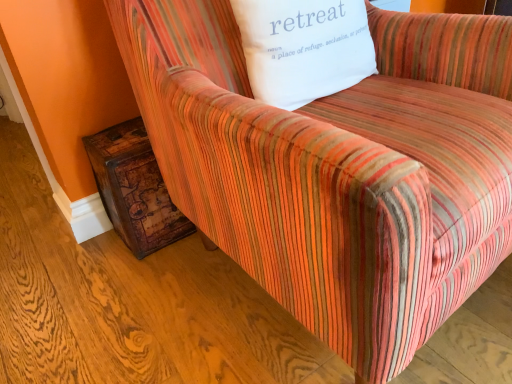
Question: Visually, is white cotton pillow at upper center positioned to the left or to the right of rustic wood side table at lower left?

Choices:
 (A) left
 (B) right

Answer: (B)

Question: Is point (365, 46) positioned closer to the camera than point (138, 208)?

Choices:
 (A) farther
 (B) closer

Answer: (B)

Question: Considering the positions of white cotton pillow at upper center and rustic wood side table at lower left in the image, is white cotton pillow at upper center bigger or smaller than rustic wood side table at lower left?

Choices:
 (A) big
 (B) small

Answer: (A)

Question: Considering the positions of rustic wood side table at lower left and white cotton pillow at upper center in the image, is rustic wood side table at lower left wider or thinner than white cotton pillow at upper center?

Choices:
 (A) wide
 (B) thin

Answer: (A)

Question: Is point (180, 231) closer or farther from the camera than point (348, 74)?

Choices:
 (A) farther
 (B) closer

Answer: (A)

Question: Do you think rustic wood side table at lower left is within white cotton pillow at upper center, or outside of it?

Choices:
 (A) outside
 (B) inside

Answer: (A)

Question: Would you say rustic wood side table at lower left is to the left or to the right of white cotton pillow at upper center in the picture?

Choices:
 (A) left
 (B) right

Answer: (A)